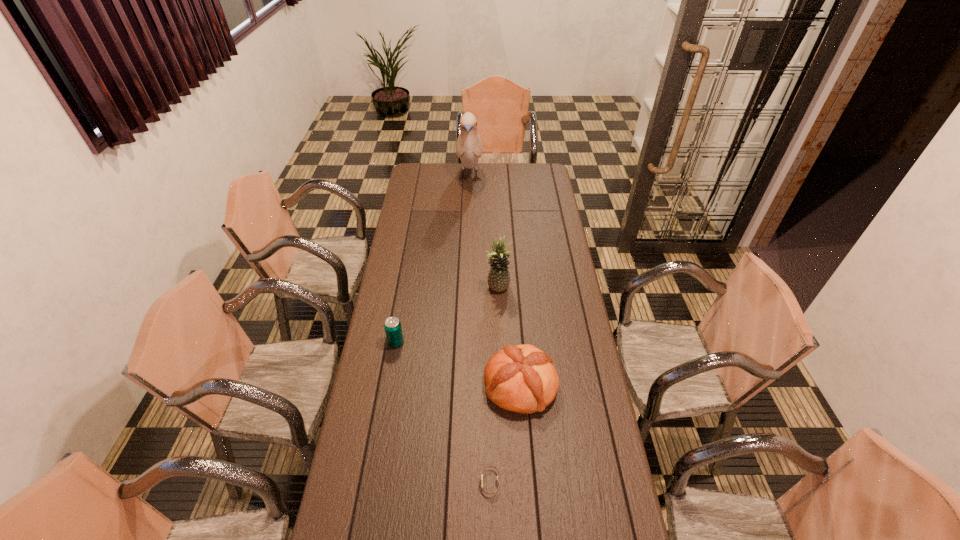
You are a GUI agent. You are given a task and a screenshot of the screen. Output one action in this format:
    pyautogui.click(x=<x>, y=<y>)
    Task: Click on the vacant region at the left edge of the desktop
    The width and height of the screenshot is (960, 540).
    Given the screenshot: What is the action you would take?
    pyautogui.click(x=401, y=402)

You are a GUI agent. You are given a task and a screenshot of the screen. Output one action in this format:
    pyautogui.click(x=<x>, y=<y>)
    Task: Click on the free space at the right edge
    Image resolution: width=960 pixels, height=540 pixels.
    Given the screenshot: What is the action you would take?
    pyautogui.click(x=545, y=241)

Locate an element on the screen. This screenshot has width=960, height=540. empty location between the second tallest object and the farthest object is located at coordinates (484, 234).

You are a GUI agent. You are given a task and a screenshot of the screen. Output one action in this format:
    pyautogui.click(x=<x>, y=<y>)
    Task: Click on the vacant space in between the shortest object and the third nearest object
    This screenshot has height=540, width=960.
    Given the screenshot: What is the action you would take?
    pyautogui.click(x=444, y=413)

The image size is (960, 540). I want to click on empty space between the watch and the fourth farthest object, so click(505, 434).

This screenshot has width=960, height=540. In order to click on free space between the second tallest object and the second nearest object in this screenshot , I will do (509, 337).

Locate an element on the screen. The width and height of the screenshot is (960, 540). object that is the second closest to the farthest object is located at coordinates (393, 329).

This screenshot has height=540, width=960. Find the location of `object that is the nearest to the farthest object`. object that is the nearest to the farthest object is located at coordinates (499, 277).

At what (x,y) coordinates should I click in order to perform the action: click on free space in the image that satisfies the following two spatial constraints: 1. on the face of the parakeet; 2. on the right side of the pineapple. Please return your answer as a coordinate pair (x, y). Image resolution: width=960 pixels, height=540 pixels. Looking at the image, I should click on (467, 289).